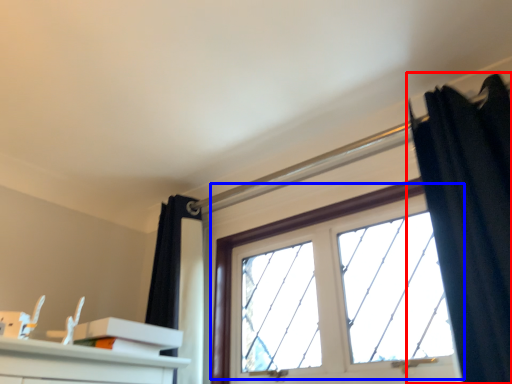
Question: Which point is further to the camera, curtain (highlighted by a red box) or window (highlighted by a blue box)?

Choices:
 (A) curtain
 (B) window

Answer: (B)